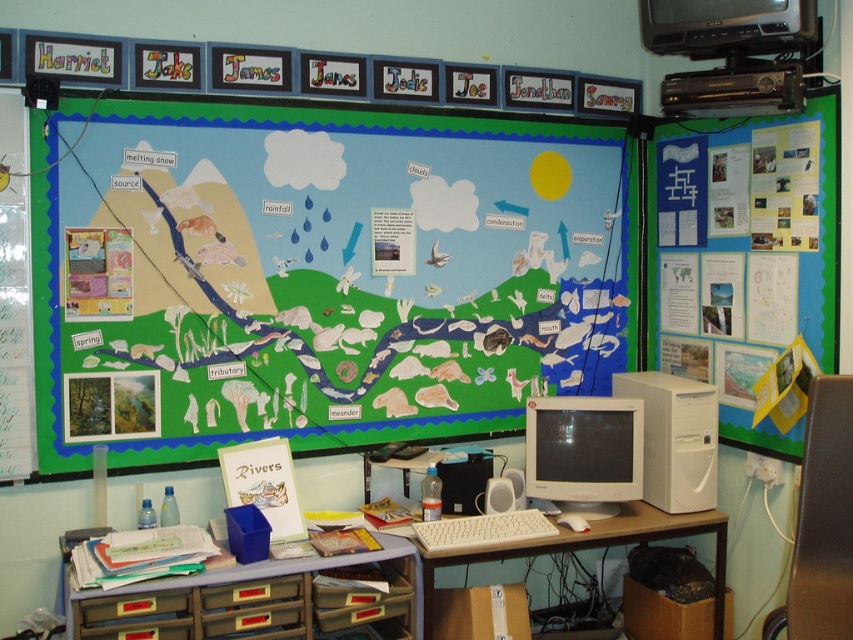
You are a student trying to determine which of the two points, point (x=729, y=96) or point (x=706, y=417), is closer to you in the classroom. Based on the image, which point is nearer?

Point (x=729, y=96) is closer to the camera than point (x=706, y=417), so it is the nearer point.

Consider the image. You are standing in the classroom facing the bulletin board. There are two points marked on the board at coordinates point (776, 45) and point (587, 531). Which point is closer to you?

Point (776, 45) is closer to the viewer than point (587, 531).

You are a student who needs to reach the white plastic desktop computer at upper right from the white plastic table at lower center. The robot you are using has a maximum reach of 1.5 meters. Can the robot reach the computer from the table?

The white plastic desktop computer at upper right is 1.58 meters from the white plastic table at lower center. Since the robot has a maximum reach of 1.5 meters, it cannot reach the computer from the table.